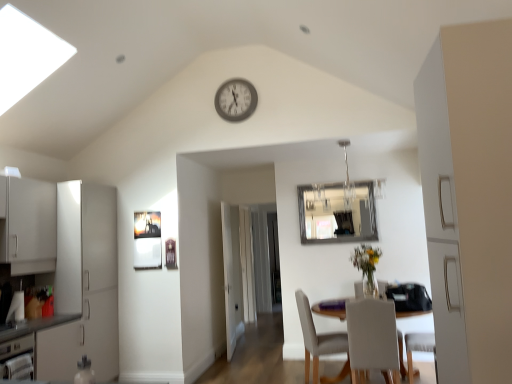
Question: From the image's perspective, is clear glass mirror at upper center under white fabric chair at lower center, acting as the second chair starting from the back?

Choices:
 (A) no
 (B) yes

Answer: (A)

Question: Is clear glass mirror at upper center bigger than white fabric chair at lower center, acting as the second chair starting from the back?

Choices:
 (A) no
 (B) yes

Answer: (A)

Question: Are clear glass mirror at upper center and white fabric chair at lower center, acting as the first chair starting from the front, beside each other?

Choices:
 (A) no
 (B) yes

Answer: (A)

Question: Is clear glass mirror at upper center thinner than white fabric chair at lower center, acting as the second chair starting from the back?

Choices:
 (A) yes
 (B) no

Answer: (A)

Question: Considering the relative sizes of clear glass mirror at upper center and white fabric chair at lower center, acting as the first chair starting from the front, in the image provided, is clear glass mirror at upper center smaller than white fabric chair at lower center, acting as the first chair starting from the front,?

Choices:
 (A) yes
 (B) no

Answer: (A)

Question: Is clear glass mirror at upper center facing away from white fabric chair at lower center, acting as the second chair starting from the back?

Choices:
 (A) yes
 (B) no

Answer: (B)

Question: Can you confirm if white glossy cabinet at left is shorter than metallic gray clock at upper center?

Choices:
 (A) yes
 (B) no

Answer: (B)

Question: Is white glossy cabinet at left far away from metallic gray clock at upper center?

Choices:
 (A) no
 (B) yes

Answer: (B)

Question: Does white glossy cabinet at left turn towards metallic gray clock at upper center?

Choices:
 (A) no
 (B) yes

Answer: (A)

Question: Is white glossy cabinet at left bigger than metallic gray clock at upper center?

Choices:
 (A) no
 (B) yes

Answer: (B)

Question: Is white glossy cabinet at left at the left side of metallic gray clock at upper center?

Choices:
 (A) no
 (B) yes

Answer: (B)

Question: From the image's perspective, would you say white glossy cabinet at left is shown under metallic gray clock at upper center?

Choices:
 (A) yes
 (B) no

Answer: (A)

Question: Is white glossy cabinet at left oriented away from metallic silver dishwasher at lower left?

Choices:
 (A) no
 (B) yes

Answer: (A)